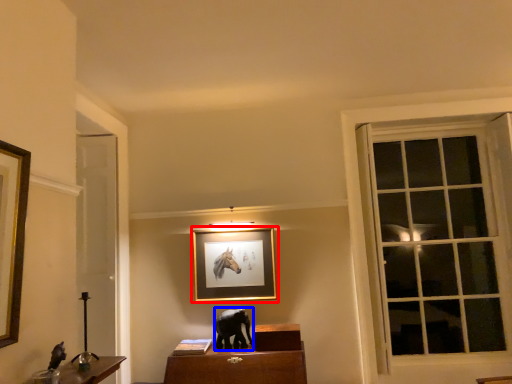
Question: Which object is closer to the camera taking this photo, picture frame (highlighted by a red box) or animal (highlighted by a blue box)?

Choices:
 (A) picture frame
 (B) animal

Answer: (B)